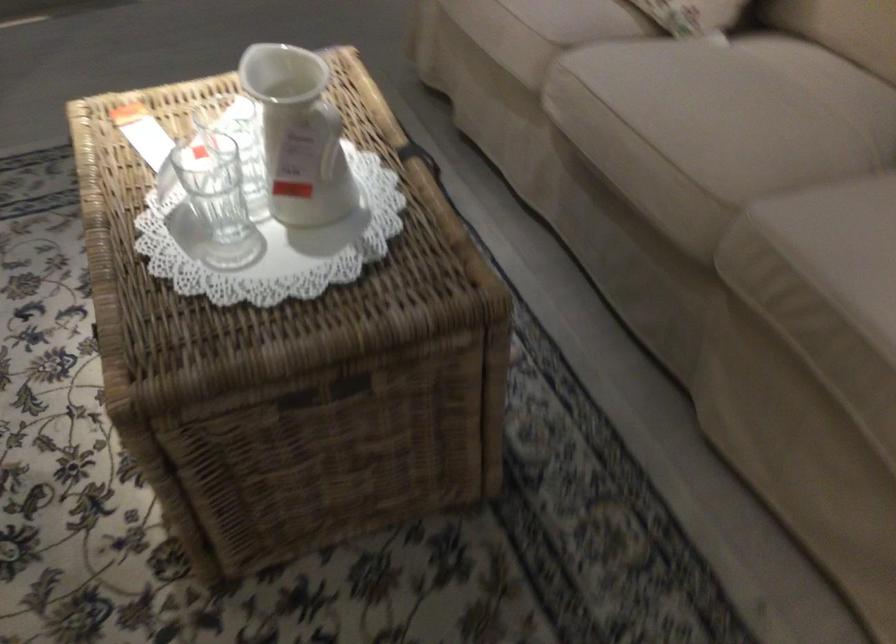
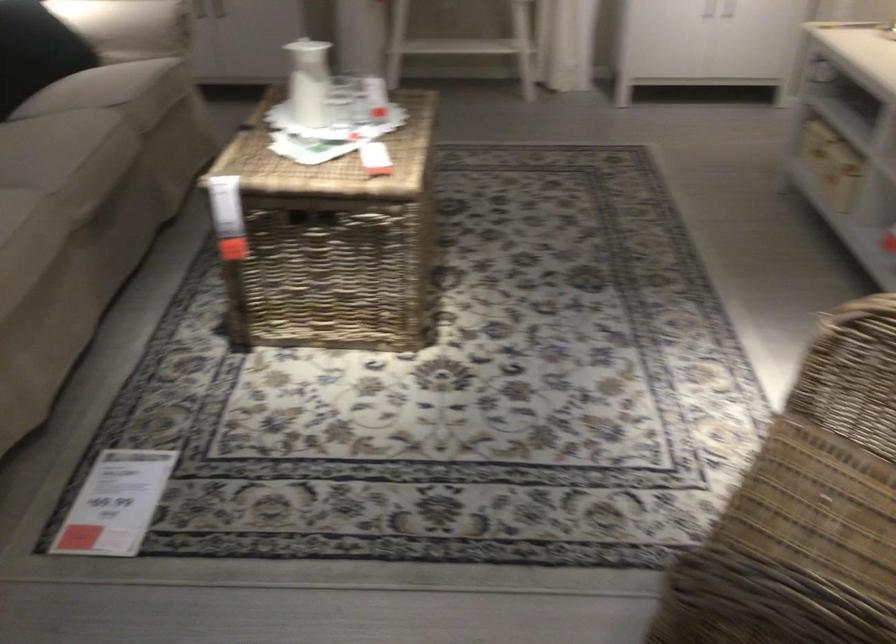
Locate, in the second image, the point that corresponds to the point at 659,149 in the first image.

(109, 140)